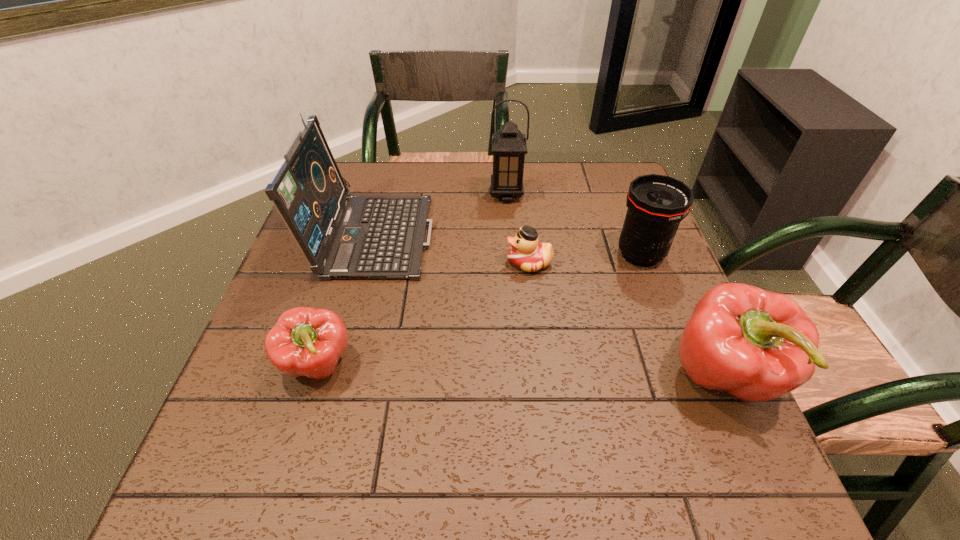
What are the coordinates of `the fifth tallest object` in the screenshot? It's located at (305, 341).

Where is `the shorter pepper`? The image size is (960, 540). the shorter pepper is located at coordinates (305, 341).

This screenshot has height=540, width=960. What are the coordinates of `the taller pepper` in the screenshot? It's located at click(x=757, y=345).

At what (x,y) coordinates should I click in order to perform the action: click on the shortest object. Please return your answer as a coordinate pair (x, y). Looking at the image, I should click on (526, 253).

Find the location of a particular element. laptop computer is located at coordinates (362, 237).

Where is `telephoto lens`? The height and width of the screenshot is (540, 960). telephoto lens is located at coordinates (657, 204).

Identify the location of lantern. (509, 147).

Image resolution: width=960 pixels, height=540 pixels. Find the location of `blank area located 0.320m on the right of the left pepper`. blank area located 0.320m on the right of the left pepper is located at coordinates (517, 364).

Image resolution: width=960 pixels, height=540 pixels. Identify the location of free location located 0.270m on the left of the taller pepper. (527, 376).

Find the location of `vacant area situated on the face of the shortest object`. vacant area situated on the face of the shortest object is located at coordinates (448, 262).